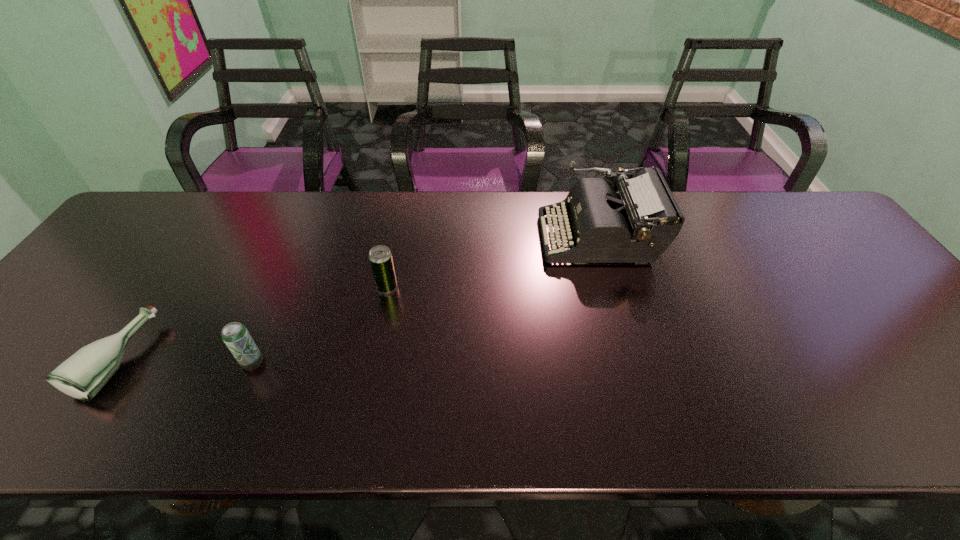
Where is `free point between the farther beer can and the second object from left to right`? The width and height of the screenshot is (960, 540). free point between the farther beer can and the second object from left to right is located at coordinates (320, 325).

Locate an element on the screen. This screenshot has width=960, height=540. free space between the farther beer can and the left beer can is located at coordinates (320, 325).

I want to click on vacant space that's between the leftmost object and the farthest object, so click(x=358, y=298).

The height and width of the screenshot is (540, 960). What are the coordinates of `free space that is in between the farther beer can and the bottle` in the screenshot? It's located at (252, 323).

I want to click on vacant space that's between the rightmost object and the leftmost object, so click(x=358, y=298).

Find the location of `vacant space in between the typewriter and the shortest object`. vacant space in between the typewriter and the shortest object is located at coordinates (358, 298).

Image resolution: width=960 pixels, height=540 pixels. Find the location of `free space that is in between the second object from right to left and the second object from left to right`. free space that is in between the second object from right to left and the second object from left to right is located at coordinates (320, 325).

What are the coordinates of `free space between the farther beer can and the rightmost object` in the screenshot? It's located at (492, 262).

At what (x,y) coordinates should I click in order to perform the action: click on vacant space that is in between the left beer can and the tallest object. Please return your answer as a coordinate pair (x, y). The height and width of the screenshot is (540, 960). Looking at the image, I should click on (425, 299).

Where is `unoccupied area between the leftmost object and the farther beer can`? The image size is (960, 540). unoccupied area between the leftmost object and the farther beer can is located at coordinates (252, 323).